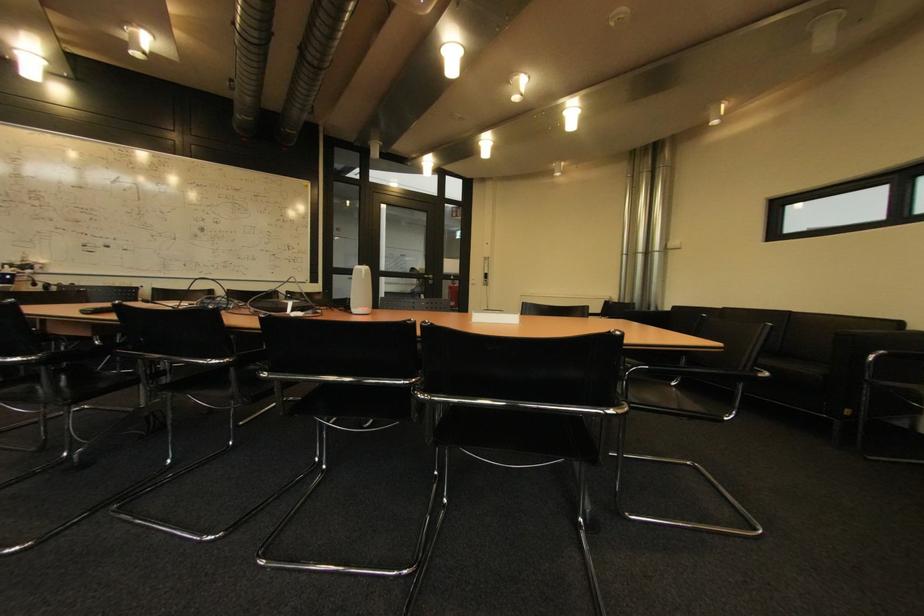
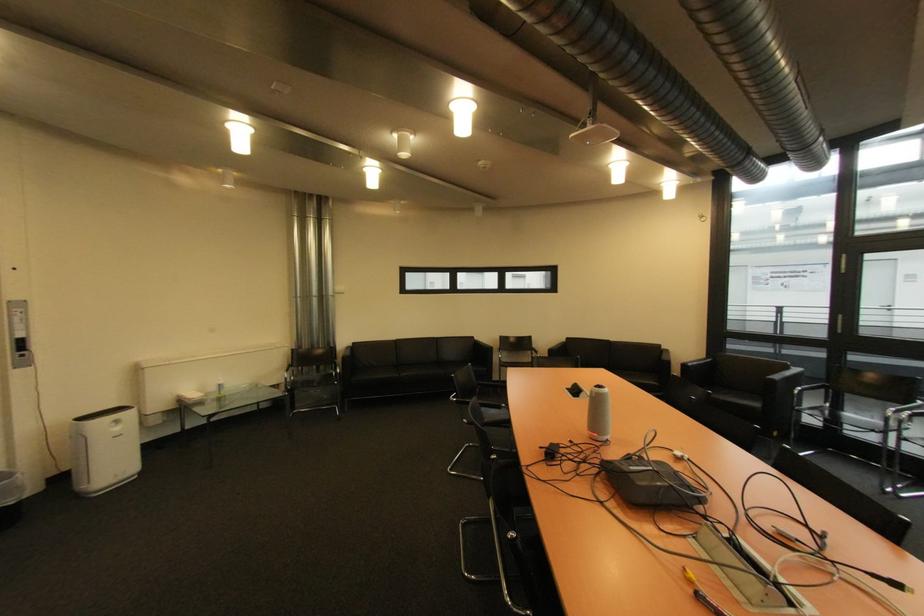
Find the pixel in the second image that matches point 493,282 in the first image.

(30, 357)